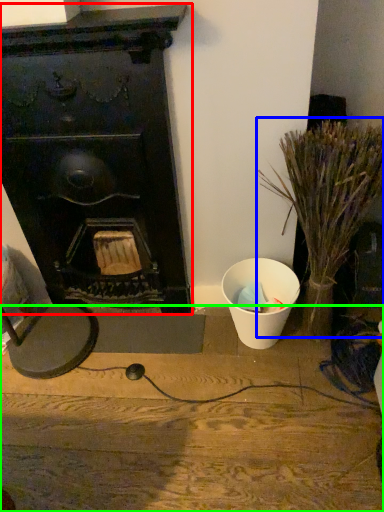
Question: Based on their relative distances, which object is farther from fireplace (highlighted by a red box)? Choose from plant (highlighted by a blue box) and furniture (highlighted by a green box).

Choices:
 (A) plant
 (B) furniture

Answer: (B)